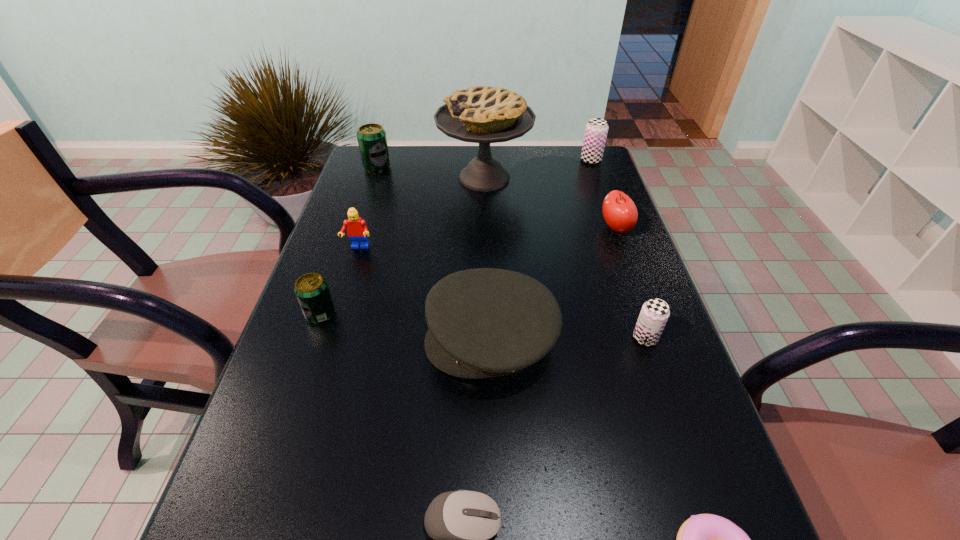
In the image, there is a desktop. At what (x,y) coordinates should I click in order to perform the action: click on vacant area at the far left corner. Please return your answer as a coordinate pair (x, y). Looking at the image, I should click on (372, 179).

I want to click on free spot at the far right corner of the desktop, so click(x=587, y=165).

This screenshot has height=540, width=960. Find the location of `empty location between the nearer green beer can and the pie`. empty location between the nearer green beer can and the pie is located at coordinates (402, 246).

Find the location of a particular element. free space between the bigger green beer can and the pie is located at coordinates (431, 173).

Where is `vacant space that is in between the pie and the nearest beer can`? vacant space that is in between the pie and the nearest beer can is located at coordinates (564, 258).

The image size is (960, 540). Find the location of `free space between the gray beret and the farther green beer can`. free space between the gray beret and the farther green beer can is located at coordinates (434, 254).

Where is `free space between the pie and the smaller green beer can`? free space between the pie and the smaller green beer can is located at coordinates (402, 246).

The width and height of the screenshot is (960, 540). Identify the location of blank region between the apple and the tallest object. (550, 203).

The width and height of the screenshot is (960, 540). Identify the location of object that can be found as the second closest to the fourth farthest object. point(486,322).

Find the location of a particular element. The height and width of the screenshot is (540, 960). object that is the ninth nearest to the bigger green beer can is located at coordinates (705, 539).